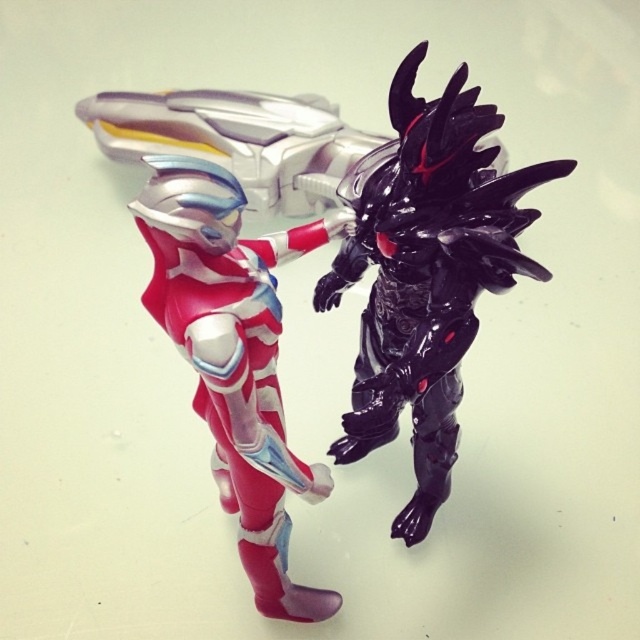
Question: Among these points, which one is farthest from the camera?

Choices:
 (A) (140, 97)
 (B) (252, 529)
 (C) (424, 48)

Answer: (A)

Question: Is shiny metallic robot at center behind shiny metallic suit at center?

Choices:
 (A) no
 (B) yes

Answer: (B)

Question: Based on their relative distances, which object is farther from the shiny metallic suit at center?

Choices:
 (A) shiny metallic robot at center
 (B) glossy black figure at right

Answer: (B)

Question: Which of the following is the farthest from the observer?

Choices:
 (A) shiny metallic robot at center
 (B) shiny metallic suit at center

Answer: (A)

Question: From the image, what is the correct spatial relationship of shiny metallic robot at center in relation to glossy black figure at right?

Choices:
 (A) above
 (B) below

Answer: (B)

Question: Can you confirm if shiny metallic robot at center is positioned below glossy black figure at right?

Choices:
 (A) no
 (B) yes

Answer: (B)